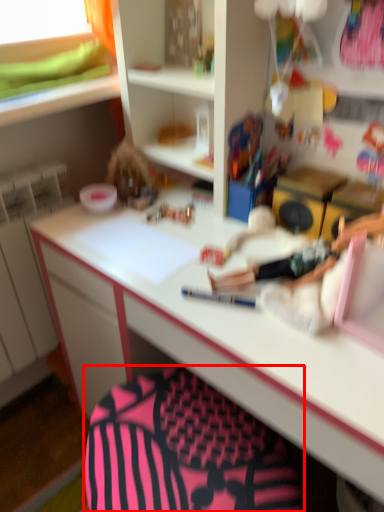
Question: From the image's perspective, what is the correct spatial positioning of swivel chair (annotated by the red box) in reference to stationery?

Choices:
 (A) below
 (B) above

Answer: (A)